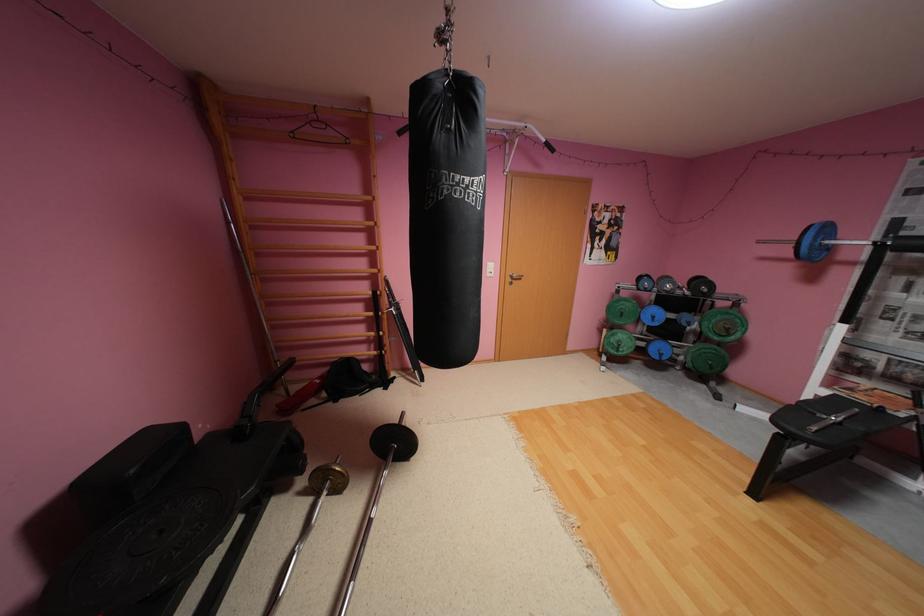
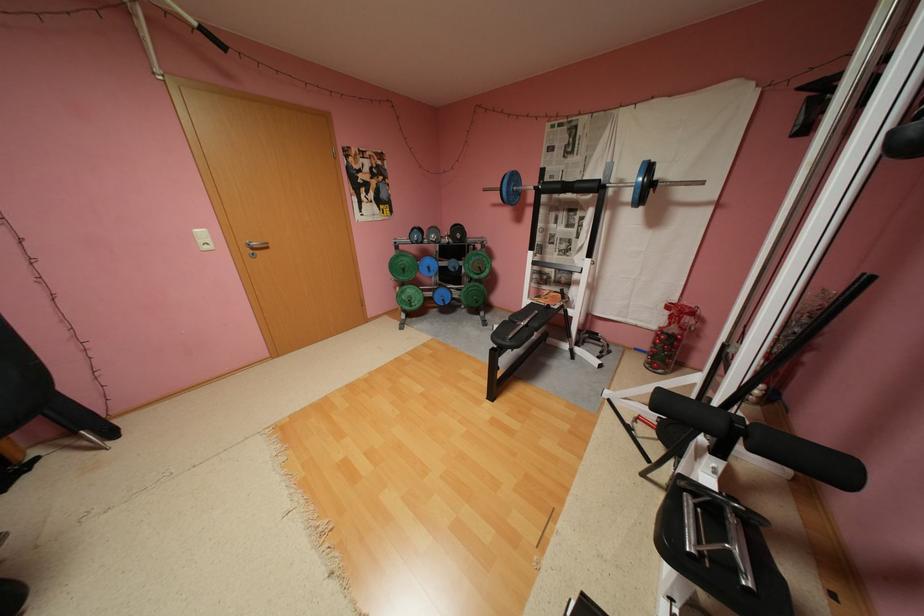
Find the pixel in the second image that matches point (821, 246) in the first image.

(517, 191)